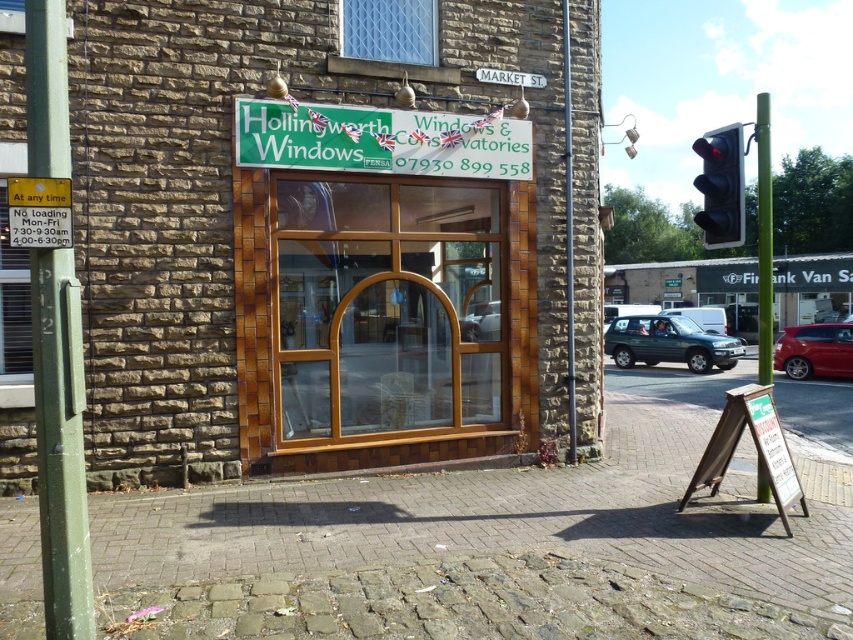
Measure the distance between metallic traffic light at upper right and camera.

A distance of 6.28 meters exists between metallic traffic light at upper right and camera.

Who is positioned more to the left, metallic traffic light at upper right or white plastic street sign at upper center?

white plastic street sign at upper center

Is point (708, 198) behind point (483, 77)?

No, it is not.

The height and width of the screenshot is (640, 853). Find the location of `metallic traffic light at upper right`. metallic traffic light at upper right is located at coordinates (721, 186).

Does green painted metal pole at left appear under white plastic street sign at upper center?

Yes, green painted metal pole at left is below white plastic street sign at upper center.

Can you confirm if green painted metal pole at left is wider than white plastic street sign at upper center?

No, green painted metal pole at left is not wider than white plastic street sign at upper center.

Between point (53, 627) and point (543, 81), which one is positioned behind?

Positioned behind is point (543, 81).

This screenshot has width=853, height=640. I want to click on green painted metal pole at left, so click(x=61, y=445).

Can you confirm if green plastic signboard at upper center is positioned above metallic silver car at right?

Indeed, green plastic signboard at upper center is positioned over metallic silver car at right.

Between green plastic signboard at upper center and metallic silver car at right, which one has more height?

With more height is metallic silver car at right.

At what (x,y) coordinates should I click in order to perform the action: click on green plastic signboard at upper center. Please return your answer as a coordinate pair (x, y). This screenshot has width=853, height=640. Looking at the image, I should click on (380, 140).